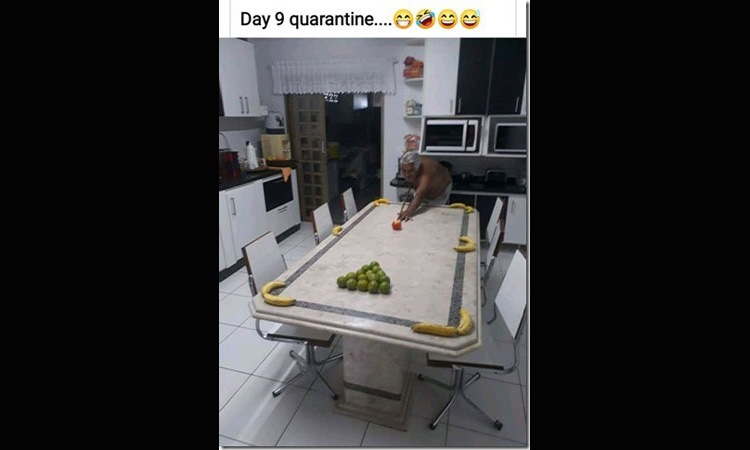
I want to click on oven, so click(x=280, y=208).